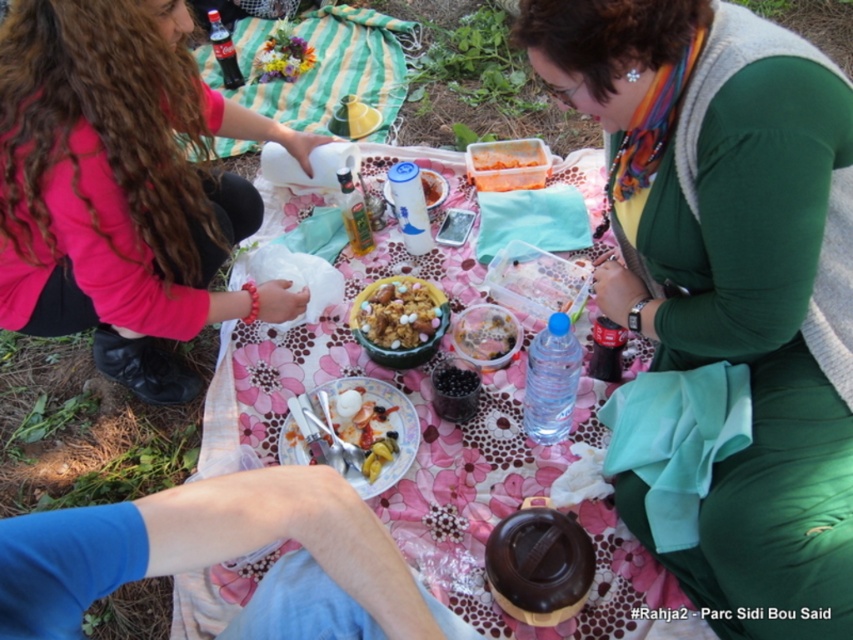
You are organizing a picnic and need to place the matte pink sweater at upper left and the green striped blanket at upper center on a table. According to the image, which item is positioned more to the left?

The matte pink sweater at upper left is positioned more to the left than the green striped blanket at upper center.

You are a photographer standing at the camera position. You want to take a photo of the picnic scene but need to ensure the blue denim jeans at lower left are not in the frame. What should you do?

The blue denim jeans at lower left are 24.04 inches away from the camera. To exclude them from the frame, move the camera position further away from the blue denim jeans at lower left or adjust the camera angle to avoid capturing them.

You are a photographer setting up a shot of the picnic scene. You need to ensure that the matte pink sweater at upper left and the green striped blanket at upper center are both in focus. Which object should you adjust your camera focus on first to account for their heights?

The matte pink sweater at upper left is taller than the green striped blanket at upper center, so you should focus on the matte pink sweater at upper left first to ensure depth of field accommodates its height.